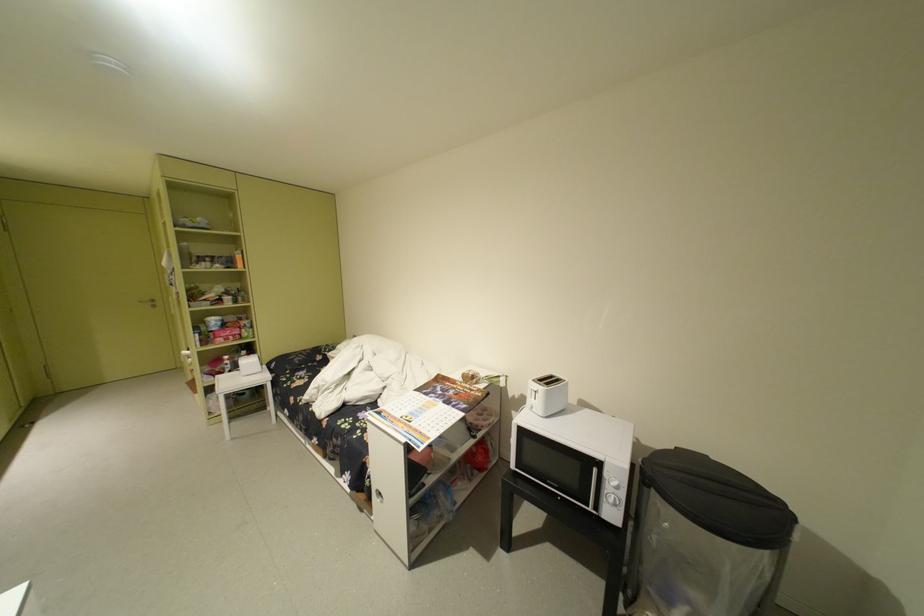
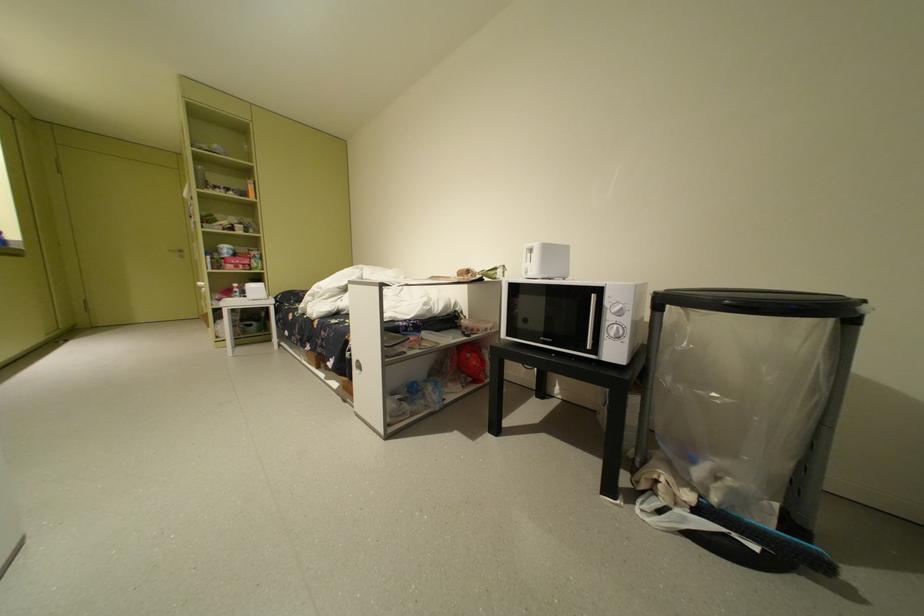
Question: The camera is either moving clockwise (left) or counter-clockwise (right) around the object. The first image is from the beginning of the video and the second image is from the end. Is the camera moving left or right when shooting the video?

Choices:
 (A) Left
 (B) Right

Answer: (B)